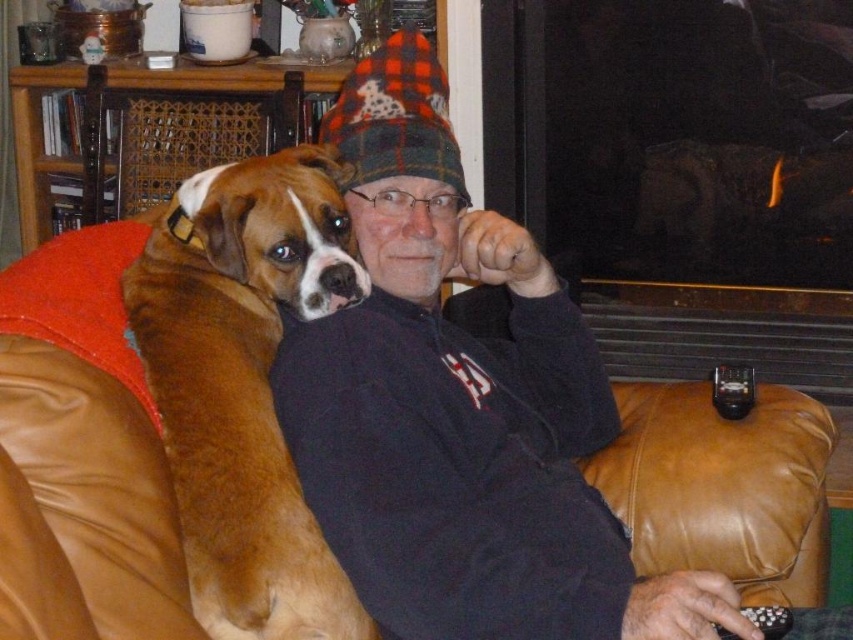
You are a photographer setting up a shoot in this scene. You need to position a light source to the right of the dark blue fleece jacket at center and to the left of the brown fur dog at left. Is this possible?

The dark blue fleece jacket at center is to the right of the brown fur dog at left, so placing a light source to the right of the jacket and to the left of the dog would not be possible since the jacket is already positioned to the right of the dog.

Consider the image. You are a tailor who needs to determine if the dark blue fleece jacket at center can fit into a storage box designed for small items. Given that the brown fur dog at left is already inside the box, would the jacket also fit?

The dark blue fleece jacket at center is larger in size than the brown fur dog at left. Since the dog is already in the box, the jacket, being bigger, likely won